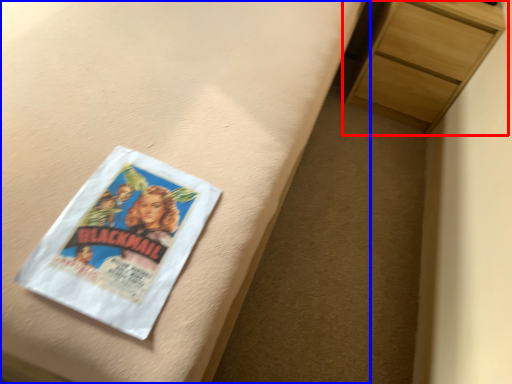
Question: Which object appears farthest to the camera in this image, chest of drawers (highlighted by a red box) or bed frame (highlighted by a blue box)?

Choices:
 (A) chest of drawers
 (B) bed frame

Answer: (A)